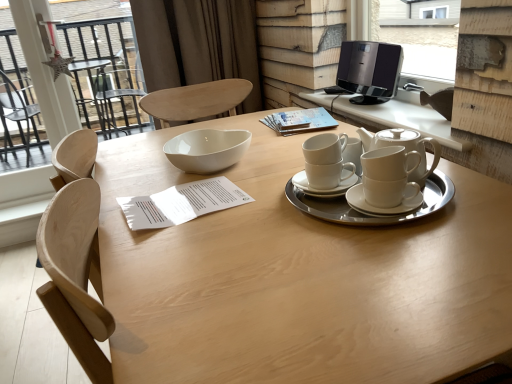
Question: From the image's perspective, would you say white ceramic cups at center is shown under black glossy speaker at upper right?

Choices:
 (A) no
 (B) yes

Answer: (B)

Question: Is white ceramic cups at center taller than black glossy speaker at upper right?

Choices:
 (A) no
 (B) yes

Answer: (A)

Question: Considering the relative positions of white ceramic cups at center and black glossy speaker at upper right in the image provided, is white ceramic cups at center in front of black glossy speaker at upper right?

Choices:
 (A) no
 (B) yes

Answer: (B)

Question: Is white ceramic cups at center thinner than black glossy speaker at upper right?

Choices:
 (A) no
 (B) yes

Answer: (A)

Question: Can you confirm if white ceramic cups at center is positioned to the right of black glossy speaker at upper right?

Choices:
 (A) no
 (B) yes

Answer: (A)

Question: Considering the positions of transparent glass door at upper left and white ceramic cups at center in the image, is transparent glass door at upper left taller or shorter than white ceramic cups at center?

Choices:
 (A) short
 (B) tall

Answer: (B)

Question: From a real-world perspective, relative to white ceramic cups at center, is transparent glass door at upper left vertically above or below?

Choices:
 (A) below
 (B) above

Answer: (B)

Question: From the image's perspective, is transparent glass door at upper left above or below white ceramic cups at center?

Choices:
 (A) below
 (B) above

Answer: (B)

Question: Would you say transparent glass door at upper left is inside or outside white ceramic cups at center?

Choices:
 (A) outside
 (B) inside

Answer: (A)

Question: Based on their positions, is brown fabric curtain at upper center located to the left or right of white ceramic cups at center?

Choices:
 (A) left
 (B) right

Answer: (A)

Question: In terms of height, does brown fabric curtain at upper center look taller or shorter compared to white ceramic cups at center?

Choices:
 (A) tall
 (B) short

Answer: (A)

Question: Considering their positions, is brown fabric curtain at upper center located in front of or behind white ceramic cups at center?

Choices:
 (A) behind
 (B) front

Answer: (A)

Question: Considering the positions of brown fabric curtain at upper center and white ceramic cups at center in the image, is brown fabric curtain at upper center wider or thinner than white ceramic cups at center?

Choices:
 (A) wide
 (B) thin

Answer: (B)

Question: In the image, is black plastic speaker at upper right on the left side or the right side of transparent glass door at upper left?

Choices:
 (A) left
 (B) right

Answer: (B)

Question: From a real-world perspective, is black plastic speaker at upper right positioned above or below transparent glass door at upper left?

Choices:
 (A) above
 (B) below

Answer: (A)